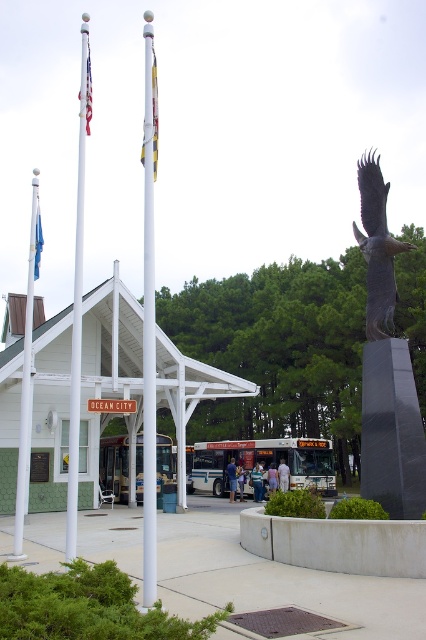
Does white glossy flag pole at left have a greater height compared to white flagpole at left?

Indeed, white glossy flag pole at left has a greater height compared to white flagpole at left.

The height and width of the screenshot is (640, 426). I want to click on white glossy flag pole at left, so click(77, 317).

Does point (80, 308) lie behind point (28, 252)?

No, it is in front of (28, 252).

Image resolution: width=426 pixels, height=640 pixels. Find the location of `white glossy flag pole at left`. white glossy flag pole at left is located at coordinates (77, 317).

Between black granite monument at center right and matte white flag at left, which one has less height?

Standing shorter between the two is black granite monument at center right.

Identify the location of black granite monument at center right. Image resolution: width=426 pixels, height=640 pixels. (391, 429).

At what (x,y) coordinates should I click in order to perform the action: click on black granite monument at center right. Please return your answer as a coordinate pair (x, y). This screenshot has height=640, width=426. Looking at the image, I should click on (391, 429).

Is point (379, 408) positioned in front of point (75, 394)?

No.

Which is in front, point (391, 396) or point (74, 556)?

Point (74, 556) is more forward.

Is point (417, 516) farther from camera compared to point (71, 385)?

Yes, it is behind point (71, 385).

The width and height of the screenshot is (426, 640). In order to click on black granite monument at center right in this screenshot , I will do `click(391, 429)`.